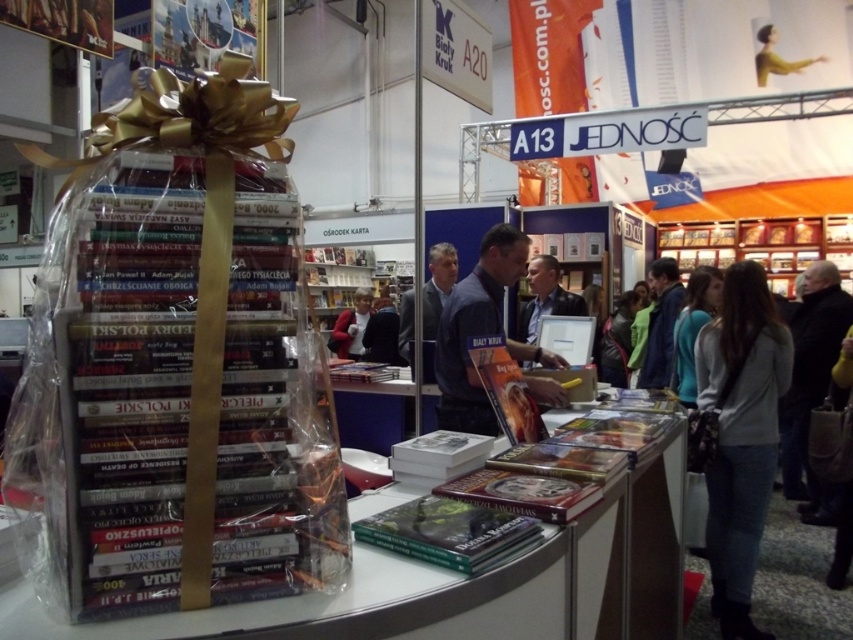
Is gray sweater at lower right wider than blue fabric jacket at center?

In fact, gray sweater at lower right might be narrower than blue fabric jacket at center.

Is gray sweater at lower right smaller than blue fabric jacket at center?

Indeed, gray sweater at lower right has a smaller size compared to blue fabric jacket at center.

Which is in front, point (758, 497) or point (431, 291)?

Point (758, 497) is more forward.

In order to click on gray sweater at lower right in this screenshot , I will do `click(740, 435)`.

Is the position of blue fabric jacket at lower right less distant than that of dark brown leather jacket at center?

Yes, blue fabric jacket at lower right is in front of dark brown leather jacket at center.

Does blue fabric jacket at lower right have a lesser width compared to dark brown leather jacket at center?

No, blue fabric jacket at lower right is not thinner than dark brown leather jacket at center.

Locate an element on the screen. This screenshot has height=640, width=853. blue fabric jacket at lower right is located at coordinates (692, 330).

Which is in front, point (822, 484) or point (534, 276)?

Point (822, 484) is more forward.

In the scene shown: Is black wool coat at lower right positioned at the back of dark brown leather jacket at center?

No, it is not.

Does point (793, 387) come farther from viewer compared to point (560, 268)?

No, it is not.

Find the location of `black wool coat at lower right`. black wool coat at lower right is located at coordinates (813, 378).